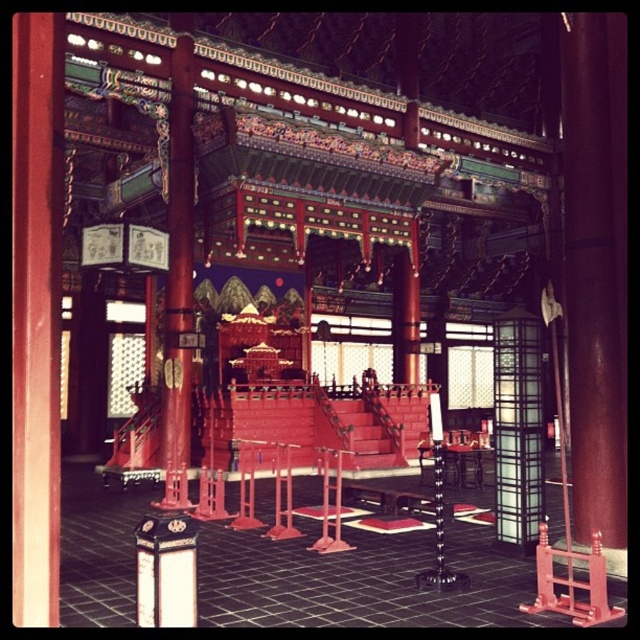
Based on the scene description, where is the smooth polished wood pole at left located in terms of its 2D coordinates?

The smooth polished wood pole at left is located at coordinates (179,278).

You are an interior designer planning to hang a new decorative banner between the smooth polished wood pole at left and the black glass lantern at center. Based on their positions, where should the banner be placed?

The smooth polished wood pole at left is located below the black glass lantern at center, so the banner should be hung between them at a position that aligns with the vertical space between the two objects.

You are an architect designing a restoration project for this traditional East Asian structure. You need to ensure that the smooth wood pillar at center and the smooth polished wood pole at left are proportionate to their original designs. Based on the image, which object is significantly taller?

The smooth wood pillar at center is much taller than the smooth polished wood pole at left, so it should be maintained as the taller structure during restoration to preserve historical accuracy.